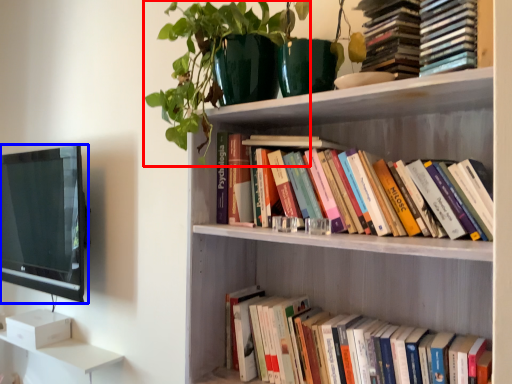
Question: Among these objects, which one is farthest to the camera, plant (highlighted by a red box) or television (highlighted by a blue box)?

Choices:
 (A) plant
 (B) television

Answer: (B)